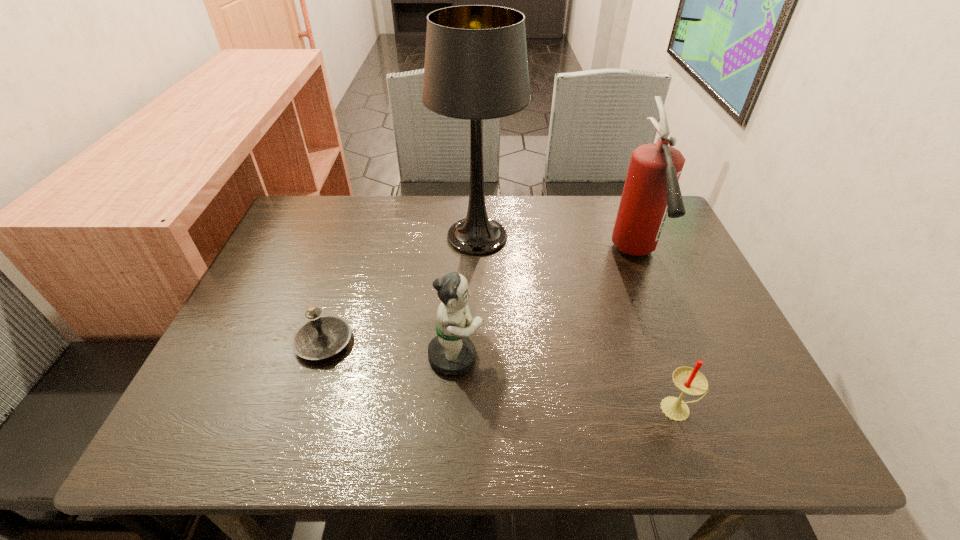
Locate an element on the screen. The width and height of the screenshot is (960, 540). vacant area situated on the back of the fourth tallest object is located at coordinates (633, 283).

Locate an element on the screen. vacant space situated 0.160m on the back of the leftmost object is located at coordinates (347, 273).

At what (x,y) coordinates should I click in order to perform the action: click on table lamp that is at the far edge. Please return your answer as a coordinate pair (x, y). The width and height of the screenshot is (960, 540). Looking at the image, I should click on (476, 68).

Where is `fire extinguisher that is at the far edge`? fire extinguisher that is at the far edge is located at coordinates (651, 191).

You are a GUI agent. You are given a task and a screenshot of the screen. Output one action in this format:
    pyautogui.click(x=<x>, y=<y>)
    Task: Click on the object that is at the near edge
    
    Given the screenshot: What is the action you would take?
    pyautogui.click(x=690, y=381)

Identify the location of object that is positioned at the left edge. The width and height of the screenshot is (960, 540). (321, 336).

I want to click on fire extinguisher located at the right edge, so click(x=651, y=191).

Where is `candle at the right edge`? The image size is (960, 540). candle at the right edge is located at coordinates (690, 381).

The width and height of the screenshot is (960, 540). What are the coordinates of `object that is at the far right corner` in the screenshot? It's located at (651, 191).

At what (x,y) coordinates should I click in order to perform the action: click on object positioned at the near right corner. Please return your answer as a coordinate pair (x, y). This screenshot has width=960, height=540. Looking at the image, I should click on (690, 381).